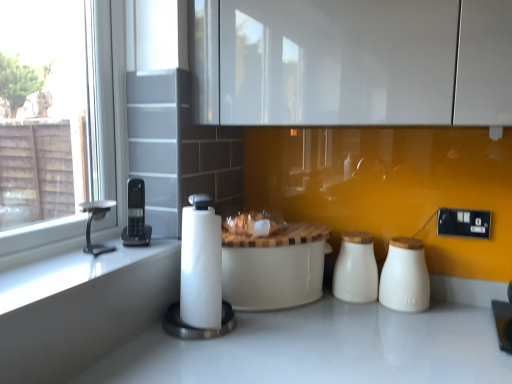
Find the location of a particular element. The image size is (512, 384). vacant area that is in front of black plastic phone at left, the 1th appliance positioned from the left is located at coordinates click(99, 260).